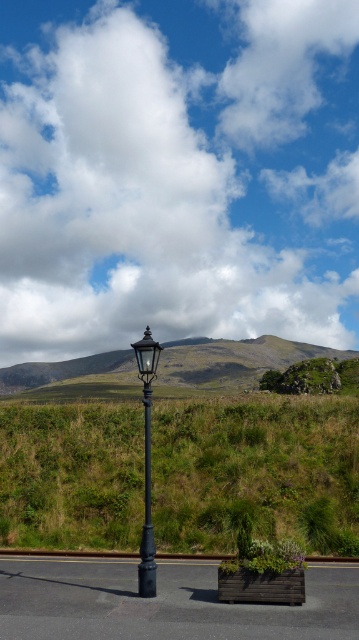
Question: Is green grassy at center wider than black metal pole at center?

Choices:
 (A) yes
 (B) no

Answer: (A)

Question: Does white fluffy cloud at upper center appear on the left side of green grassy at center?

Choices:
 (A) yes
 (B) no

Answer: (A)

Question: Where is green grassy at center located in relation to black polished street light at center in the image?

Choices:
 (A) right
 (B) left

Answer: (A)

Question: Which point appears farthest from the camera in this image?

Choices:
 (A) (145, 515)
 (B) (105, 371)
 (C) (151, 369)

Answer: (B)

Question: Which object is closer to the camera taking this photo?

Choices:
 (A) white fluffy cloud at upper center
 (B) green grassy at center
 (C) black polished street light at center

Answer: (C)

Question: Estimate the real-world distances between objects in this image. Which object is farther from the green grassy hillside at center?

Choices:
 (A) green grassy at center
 (B) black polished street light at center
 (C) black metal pole at center
 (D) white fluffy cloud at upper center

Answer: (C)